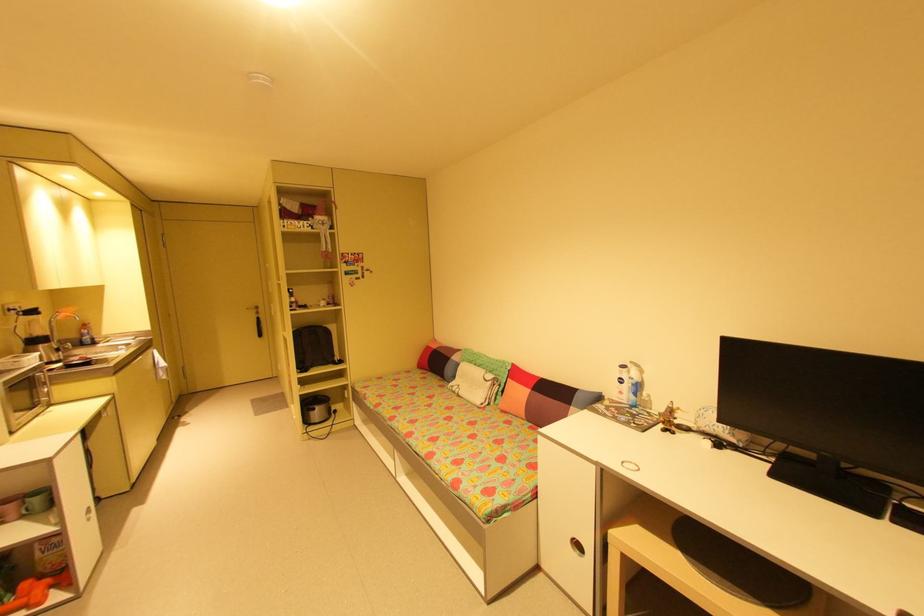
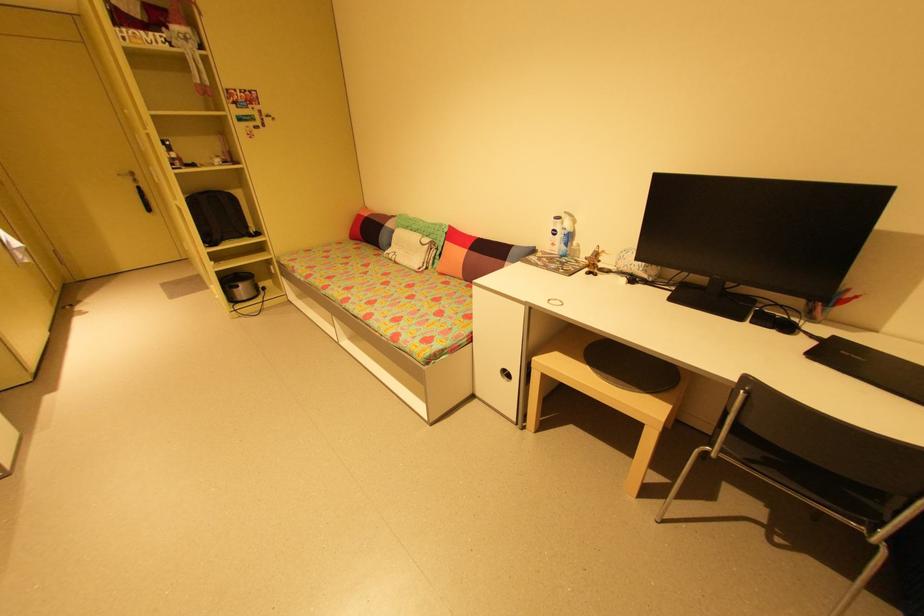
Locate, in the second image, the point that corresponds to point 672,419 in the first image.

(597, 262)